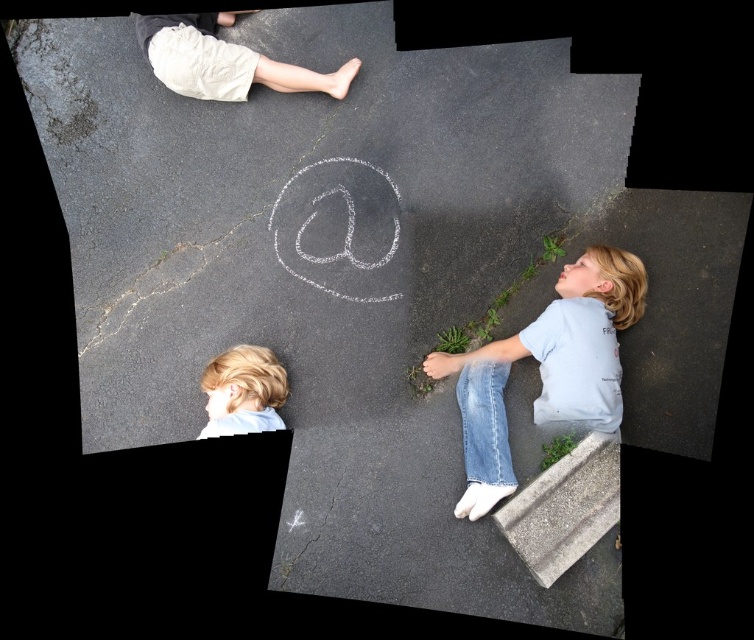
Question: Which object appears closest to the camera in this image?

Choices:
 (A) gray concrete curb at lower right
 (B) light blue denim jeans at lower right
 (C) light beige shorts at upper left

Answer: (A)

Question: Is the position of light blue denim jeans at lower right more distant than that of gray concrete curb at lower right?

Choices:
 (A) yes
 (B) no

Answer: (A)

Question: Which point appears farthest from the camera in this image?

Choices:
 (A) (440, 371)
 (B) (546, 576)
 (C) (274, 86)
 (D) (247, 352)

Answer: (C)

Question: Which object is farther from the camera taking this photo?

Choices:
 (A) light beige shorts at upper left
 (B) light blue denim jeans at lower right

Answer: (A)

Question: Is light blue denim jeans at lower right behind light beige shorts at upper left?

Choices:
 (A) no
 (B) yes

Answer: (A)

Question: Can you confirm if light blue denim jeans at lower right is wider than gray concrete curb at lower right?

Choices:
 (A) no
 (B) yes

Answer: (B)